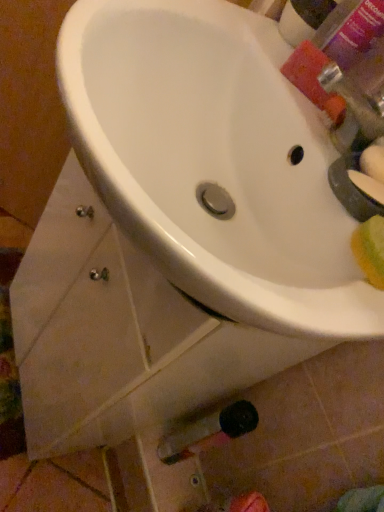
Question: From the image's perspective, relative to white glossy sink at center, is green matte soap at right above or below?

Choices:
 (A) above
 (B) below

Answer: (B)

Question: Is green matte soap at right spatially inside white glossy sink at center, or outside of it?

Choices:
 (A) inside
 (B) outside

Answer: (A)

Question: Which object is the closest to the green matte soap at right?

Choices:
 (A) pink matte bottle at upper right
 (B) white glossy sink at center

Answer: (B)

Question: Which is nearer to the green matte soap at right?

Choices:
 (A) pink matte bottle at upper right
 (B) white glossy sink at center

Answer: (B)